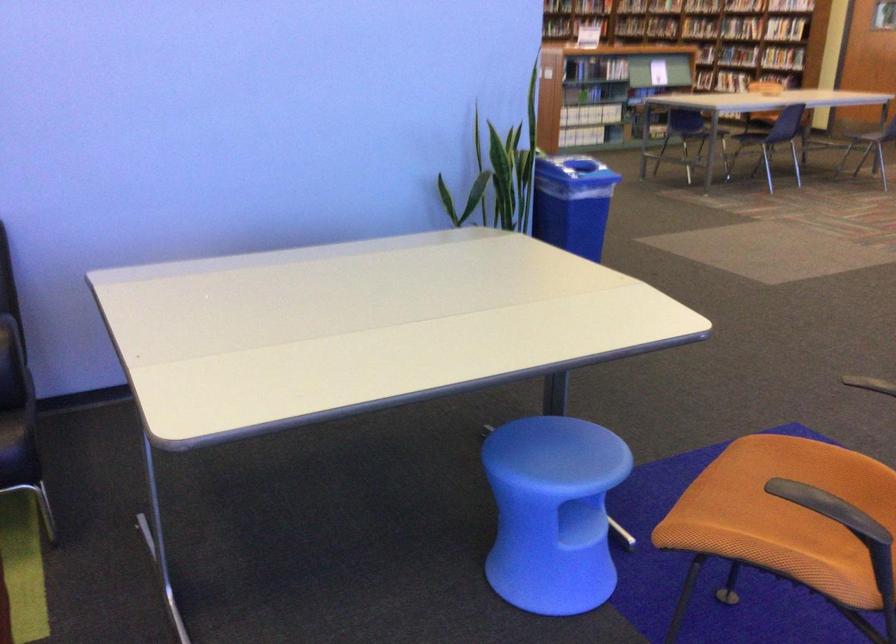
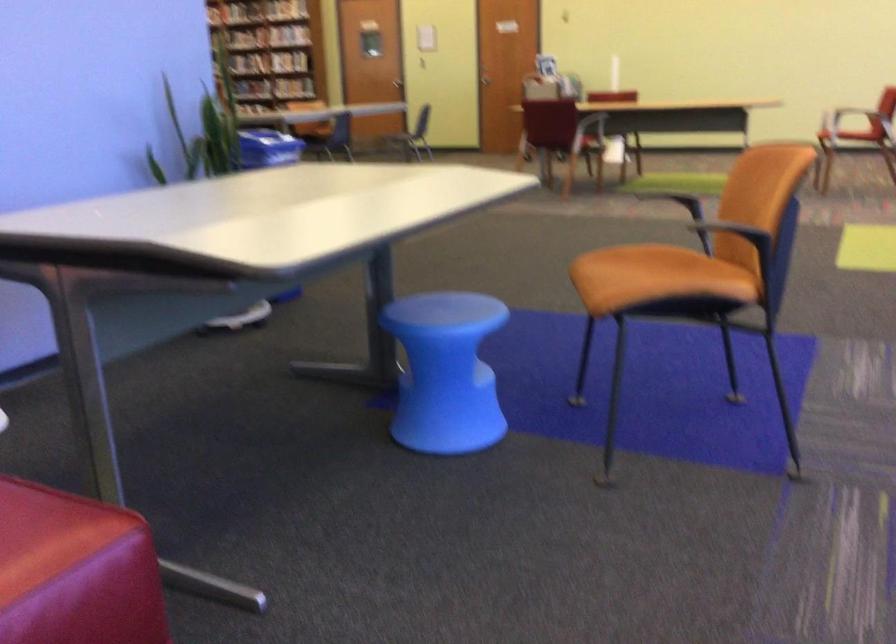
Locate, in the second image, the point that corresponds to point 566,184 in the first image.

(268, 147)